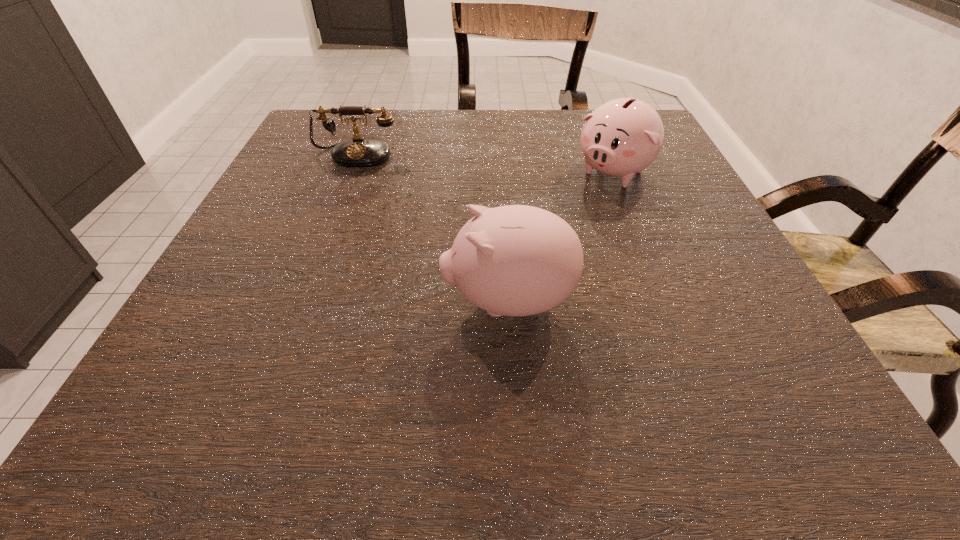
In the image, there is a desktop. Identify the location of vacant region at the far left corner. The image size is (960, 540). (345, 117).

Image resolution: width=960 pixels, height=540 pixels. Identify the location of vacant area at the near right corner. (819, 407).

You are a GUI agent. You are given a task and a screenshot of the screen. Output one action in this format:
    pyautogui.click(x=<x>, y=<y>)
    Task: Click on the vacant area between the rightmost object and the telephone
    This screenshot has width=960, height=540.
    Given the screenshot: What is the action you would take?
    pyautogui.click(x=486, y=163)

At what (x,y) coordinates should I click in order to perform the action: click on free space between the telephone and the left piggy bank. Please return your answer as a coordinate pair (x, y). This screenshot has height=540, width=960. Looking at the image, I should click on (433, 228).

The width and height of the screenshot is (960, 540). Identify the location of free area in between the second object from left to right and the shortest object. (433, 228).

At what (x,y) coordinates should I click in order to perform the action: click on free spot between the shortest object and the nearest object. Please return your answer as a coordinate pair (x, y). Looking at the image, I should click on (433, 228).

Identify the location of free space between the nearer piggy bank and the leftmost object. (433, 228).

Find the location of `vacant region between the shortest object and the farther piggy bank`. vacant region between the shortest object and the farther piggy bank is located at coordinates [x=486, y=163].

Identify which object is located as the second nearest to the shortest object. Please provide its 2D coordinates. Your answer should be formatted as a tuple, i.e. [(x, y)], where the tuple contains the x and y coordinates of a point satisfying the conditions above.

[(622, 137)]

At what (x,y) coordinates should I click in order to perform the action: click on object that is the nearest to the right piggy bank. Please return your answer as a coordinate pair (x, y). Looking at the image, I should click on (516, 260).